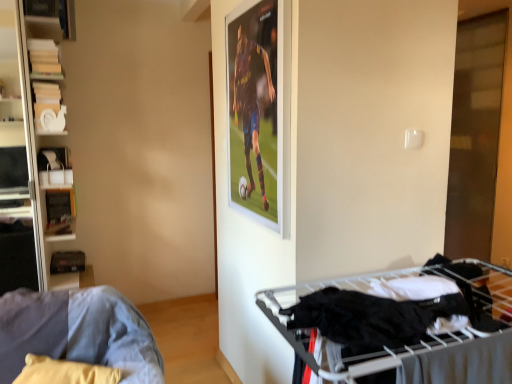
Question: Can you confirm if black fabric at lower right is bigger than white matte bookshelf at left?

Choices:
 (A) no
 (B) yes

Answer: (A)

Question: Is black fabric at lower right positioned before white matte bookshelf at left?

Choices:
 (A) yes
 (B) no

Answer: (A)

Question: Considering the relative sizes of black fabric at lower right and white matte bookshelf at left in the image provided, is black fabric at lower right taller than white matte bookshelf at left?

Choices:
 (A) no
 (B) yes

Answer: (A)

Question: Is black fabric at lower right thinner than white matte bookshelf at left?

Choices:
 (A) yes
 (B) no

Answer: (B)

Question: Considering the relative positions of black fabric at lower right and white matte bookshelf at left in the image provided, is black fabric at lower right to the right of white matte bookshelf at left from the viewer's perspective?

Choices:
 (A) yes
 (B) no

Answer: (A)

Question: Does black fabric at lower right have a greater width compared to white matte bookshelf at left?

Choices:
 (A) no
 (B) yes

Answer: (B)

Question: Can you confirm if white matte bookshelf at left is taller than denim fabric couch at lower left?

Choices:
 (A) yes
 (B) no

Answer: (A)

Question: Is white matte bookshelf at left outside of denim fabric couch at lower left?

Choices:
 (A) yes
 (B) no

Answer: (A)

Question: Can you confirm if white matte bookshelf at left is bigger than denim fabric couch at lower left?

Choices:
 (A) yes
 (B) no

Answer: (A)

Question: Considering the relative sizes of white matte bookshelf at left and denim fabric couch at lower left in the image provided, is white matte bookshelf at left thinner than denim fabric couch at lower left?

Choices:
 (A) yes
 (B) no

Answer: (A)

Question: From the image's perspective, does white matte bookshelf at left appear higher than denim fabric couch at lower left?

Choices:
 (A) no
 (B) yes

Answer: (B)

Question: Can you confirm if white matte bookshelf at left is positioned to the left of denim fabric couch at lower left?

Choices:
 (A) yes
 (B) no

Answer: (A)

Question: Is denim fabric couch at lower left touching black fabric at lower right?

Choices:
 (A) yes
 (B) no

Answer: (B)